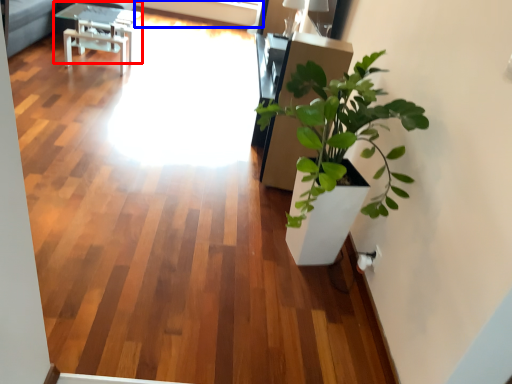
Question: Which point is closer to the camera, table (highlighted by a red box) or window screen (highlighted by a blue box)?

Choices:
 (A) table
 (B) window screen

Answer: (A)